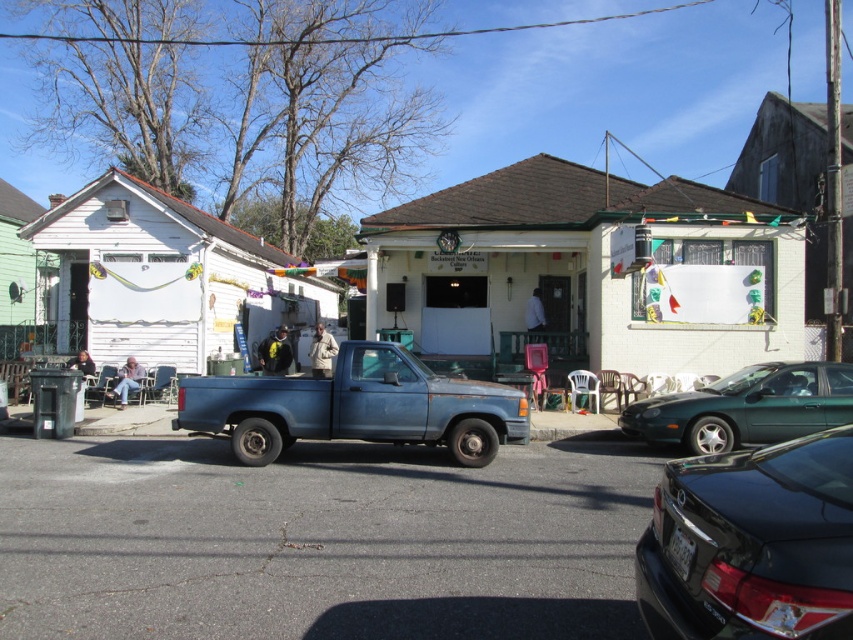
Who is lower down, black glossy sedan at lower right or green matte car at center?

green matte car at center is lower down.

Which is more to the left, black glossy sedan at lower right or green matte car at center?

black glossy sedan at lower right is more to the left.

Who is more distant from viewer, (711, 604) or (746, 387)?

The point (746, 387) is behind.

You are a GUI agent. You are given a task and a screenshot of the screen. Output one action in this format:
    pyautogui.click(x=<x>, y=<y>)
    Task: Click on the black glossy sedan at lower right
    The width and height of the screenshot is (853, 640).
    Given the screenshot: What is the action you would take?
    pyautogui.click(x=750, y=541)

From the picture: Does rusty blue pickup truck at center come behind green matte car at center?

That is False.

Is rusty blue pickup truck at center above green matte car at center?

Indeed, rusty blue pickup truck at center is positioned over green matte car at center.

Where is `rusty blue pickup truck at center`? The image size is (853, 640). rusty blue pickup truck at center is located at coordinates (357, 406).

In the scene shown: Is black glossy sedan at lower right smaller than rusty blue pickup truck at center?

Indeed, black glossy sedan at lower right has a smaller size compared to rusty blue pickup truck at center.

Is black glossy sedan at lower right bigger than rusty blue pickup truck at center?

Incorrect, black glossy sedan at lower right is not larger than rusty blue pickup truck at center.

Where is `black glossy sedan at lower right`? Image resolution: width=853 pixels, height=640 pixels. black glossy sedan at lower right is located at coordinates (750, 541).

The width and height of the screenshot is (853, 640). In order to click on black glossy sedan at lower right in this screenshot , I will do `click(750, 541)`.